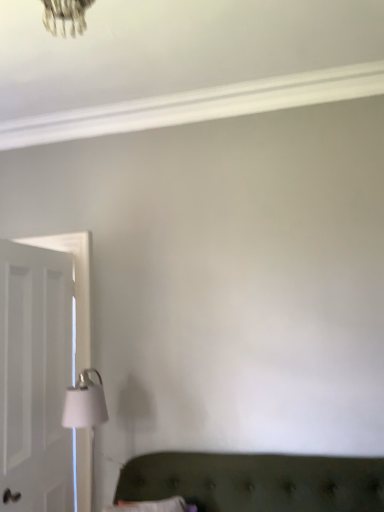
Measure the distance between point (94, 371) and camera.

Point (94, 371) and camera are 2.60 meters apart.

I want to click on white matte table lamp at lower left, so click(x=86, y=411).

Describe the element at coordinates (86, 411) in the screenshot. This screenshot has width=384, height=512. I see `white matte table lamp at lower left` at that location.

Describe the element at coordinates (36, 378) in the screenshot. I see `white wooden door at left` at that location.

You are a GUI agent. You are given a task and a screenshot of the screen. Output one action in this format:
    pyautogui.click(x=<x>, y=<y>)
    Task: Click on the white wooden door at left
    The height and width of the screenshot is (512, 384).
    Given the screenshot: What is the action you would take?
    pyautogui.click(x=36, y=378)

This screenshot has width=384, height=512. Identify the location of white matte table lamp at lower left. (86, 411).

Is white wooden door at left at the right side of white matte table lamp at lower left?

No.

Which object is further away from the camera, white wooden door at left or white matte table lamp at lower left?

white matte table lamp at lower left is further from the camera.

Considering the positions of points (53, 300) and (85, 399), is point (53, 300) closer to camera compared to point (85, 399)?

No, (53, 300) is behind (85, 399).

From the image's perspective, between white wooden door at left and white matte table lamp at lower left, who is located below?

white matte table lamp at lower left.

From a real-world perspective, is white wooden door at left beneath white matte table lamp at lower left?

No, from a real-world perspective, white wooden door at left is not beneath white matte table lamp at lower left.

In terms of width, does white wooden door at left look wider or thinner when compared to white matte table lamp at lower left?

In the image, white wooden door at left appears to be more narrow than white matte table lamp at lower left.

Looking at this image, does white wooden door at left have a lesser height compared to white matte table lamp at lower left?

In fact, white wooden door at left may be taller than white matte table lamp at lower left.

Who is smaller, white wooden door at left or white matte table lamp at lower left?

white matte table lamp at lower left is smaller.

Can white matte table lamp at lower left be found inside white wooden door at left?

No, white matte table lamp at lower left is located outside of white wooden door at left.

Is white wooden door at left far away from white matte table lamp at lower left?

No, white wooden door at left is in close proximity to white matte table lamp at lower left.

Could you tell me if white wooden door at left is turned towards white matte table lamp at lower left?

Yes, white wooden door at left is aimed at white matte table lamp at lower left.

How different are the orientations of white wooden door at left and white matte table lamp at lower left in degrees?

The angular difference between white wooden door at left and white matte table lamp at lower left is 83.7 degrees.

How distant is white wooden door at left from white matte table lamp at lower left?

white wooden door at left is 15.81 inches away from white matte table lamp at lower left.

Identify the location of table lamp below the white wooden door at left (from the image's perspective). This screenshot has width=384, height=512. (86, 411).

Is white matte table lamp at lower left to the right of white wooden door at left from the viewer's perspective?

Indeed, white matte table lamp at lower left is positioned on the right side of white wooden door at left.

Is white matte table lamp at lower left further to the viewer compared to white wooden door at left?

Yes, it is behind white wooden door at left.

Looking at this image, which point is more distant from viewer, [77,413] or [58,426]?

The point [58,426] is more distant.

From the image's perspective, is white matte table lamp at lower left beneath white wooden door at left?

Indeed, from the image's perspective, white matte table lamp at lower left is shown beneath white wooden door at left.

From a real-world perspective, who is located lower, white matte table lamp at lower left or white wooden door at left?

white matte table lamp at lower left is physically lower.

Does white matte table lamp at lower left have a lesser width compared to white wooden door at left?

Incorrect, the width of white matte table lamp at lower left is not less than that of white wooden door at left.

Considering the sizes of objects white matte table lamp at lower left and white wooden door at left in the image provided, who is taller, white matte table lamp at lower left or white wooden door at left?

With more height is white wooden door at left.

Does white matte table lamp at lower left have a smaller size compared to white wooden door at left?

Indeed, white matte table lamp at lower left has a smaller size compared to white wooden door at left.

Do you think white matte table lamp at lower left is within white wooden door at left, or outside of it?

white matte table lamp at lower left is spatially situated outside white wooden door at left.

Is white matte table lamp at lower left not near white wooden door at left?

Actually, white matte table lamp at lower left and white wooden door at left are a little close together.

Does white matte table lamp at lower left turn towards white wooden door at left?

No.

Can you tell me how much white matte table lamp at lower left and white wooden door at left differ in facing direction?

There is a 83.7-degree angle between the facing directions of white matte table lamp at lower left and white wooden door at left.

The width and height of the screenshot is (384, 512). Identify the location of door that is in front of the white matte table lamp at lower left. (36, 378).

Find the location of a particular element. The height and width of the screenshot is (512, 384). door above the white matte table lamp at lower left (from a real-world perspective) is located at coordinates (36, 378).

This screenshot has height=512, width=384. In the image, there is a white wooden door at left. What are the coordinates of `table lamp below it (from the image's perspective)` in the screenshot? It's located at (86, 411).